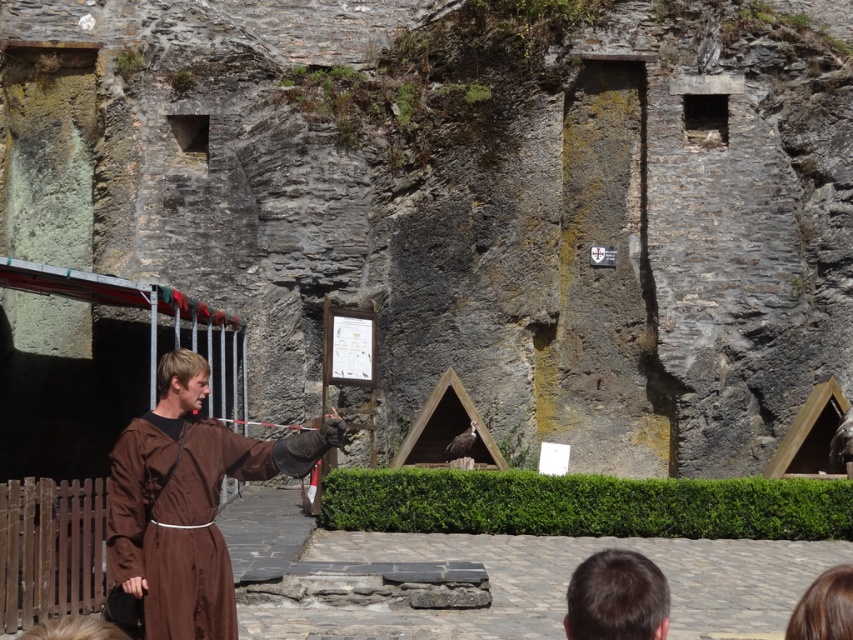
You are an event planner setting up a medieval fair and need to arrange a stage for a speaker. The stage has a cobblestone platform with a brown clothed man at center and a brown hair at lower center. Based on their positions, which object is closer to the front of the stage?

The brown hair at lower center is closer to the front of the stage because the brown clothed man at center is located above it, indicating it is positioned lower and nearer to the front.

From the picture: You are a visitor at this historical event and see the brown clothed man at center and the brown hair at lower center. Which one is positioned more to the left side?

The brown clothed man at center is positioned more to the left side than the brown hair at lower center.

You are standing at the point marked as point [184,506] in the image. What object is located at this point?

The brown clothed man at center is located at point [184,506].